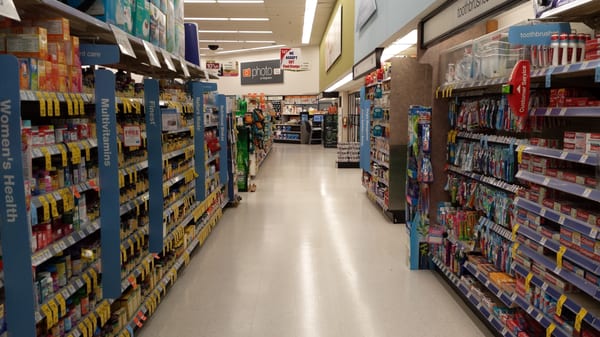
Image resolution: width=600 pixels, height=337 pixels. I want to click on wall sign that says "photo", so click(259, 69).